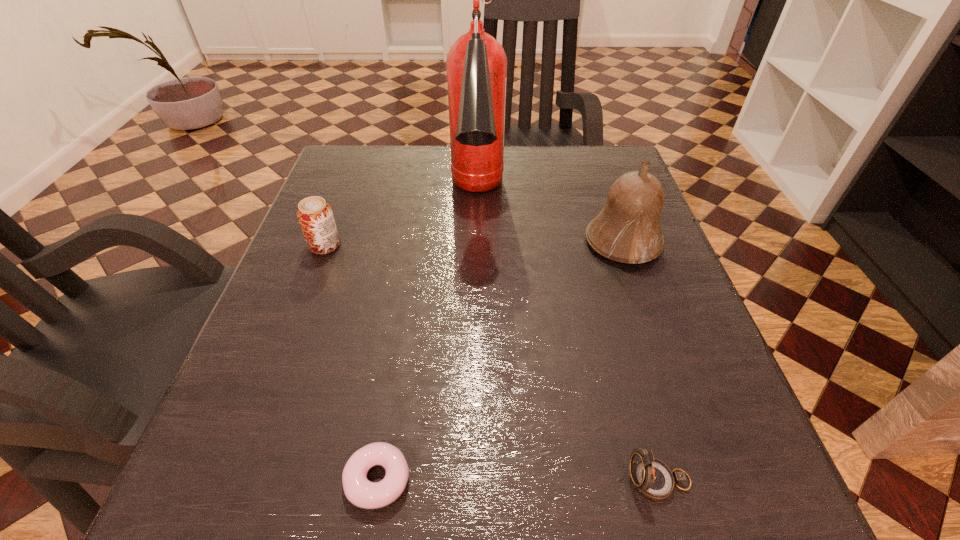
Locate an element on the screen. the third object from left to right is located at coordinates (476, 63).

The width and height of the screenshot is (960, 540). Find the location of `the tallest object`. the tallest object is located at coordinates (476, 63).

The width and height of the screenshot is (960, 540). Find the location of `bell`. bell is located at coordinates (627, 229).

Identify the location of the leftmost object. The width and height of the screenshot is (960, 540). (315, 216).

The image size is (960, 540). What are the coordinates of `beer can` in the screenshot? It's located at (315, 216).

This screenshot has height=540, width=960. In order to click on the second shortest object in this screenshot , I will do `click(653, 478)`.

At what (x,y) coordinates should I click in order to perform the action: click on the fourth object from right to left. Please return your answer as a coordinate pair (x, y). Looking at the image, I should click on (362, 493).

Find the location of a particular element. The height and width of the screenshot is (540, 960). the shortest object is located at coordinates (362, 493).

Identify the location of vacant space located 0.300m at the nozzle end of the third object from right to left. (476, 377).

I want to click on blank area located 0.350m on the left of the bell, so click(413, 242).